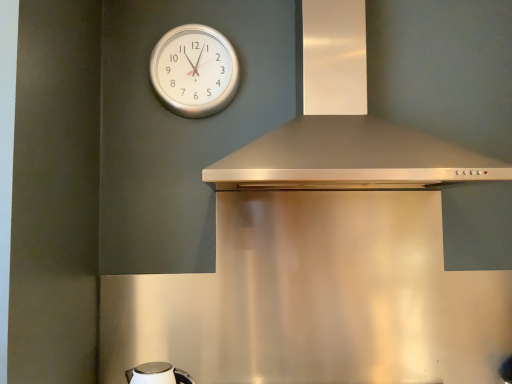
What is the approximate width of satin silver vent at upper center?

It is 48.43 centimeters.

This screenshot has width=512, height=384. What do you see at coordinates (194, 71) in the screenshot?
I see `silver metallic clock at upper center` at bounding box center [194, 71].

Measure the distance between point (170, 374) and camera.

Point (170, 374) is 5.15 feet from camera.

Where is `satin silver vent at upper center`? satin silver vent at upper center is located at coordinates (345, 126).

Is point (211, 87) closer or farther from the camera than point (149, 377)?

Clearly, point (211, 87) is more distant from the camera than point (149, 377).

Could you tell me if silver metallic clock at upper center is facing white glossy kettle at lower left?

No, silver metallic clock at upper center is not facing towards white glossy kettle at lower left.

From a real-world perspective, who is located higher, silver metallic clock at upper center or white glossy kettle at lower left?

From a 3D spatial view, silver metallic clock at upper center is above.

Where is `wall clock behind the satin silver vent at upper center`? The image size is (512, 384). wall clock behind the satin silver vent at upper center is located at coordinates (194, 71).

Could you tell me if satin silver vent at upper center is turned towards silver metallic clock at upper center?

No.

What's the angular difference between satin silver vent at upper center and silver metallic clock at upper center's facing directions?

The angular difference between satin silver vent at upper center and silver metallic clock at upper center is 0.00023 degrees.

Looking at this image, from the image's perspective, is satin silver vent at upper center over silver metallic clock at upper center?

No, from the image's perspective, satin silver vent at upper center is not over silver metallic clock at upper center.

Can you tell me how much satin silver vent at upper center and white glossy kettle at lower left differ in facing direction?

satin silver vent at upper center and white glossy kettle at lower left are facing 1.56 degrees away from each other.

Is satin silver vent at upper center placed right next to white glossy kettle at lower left?

No, satin silver vent at upper center is not in contact with white glossy kettle at lower left.

In the image, is satin silver vent at upper center on the left side or the right side of white glossy kettle at lower left?

In the image, satin silver vent at upper center appears on the right side of white glossy kettle at lower left.

Locate an element on the screen. vent located above the white glossy kettle at lower left (from the image's perspective) is located at coordinates (345, 126).

Which object is further away from the camera taking this photo, white glossy kettle at lower left or silver metallic clock at upper center?

silver metallic clock at upper center.

Between point (168, 370) and point (178, 105), which one is positioned in front?

The point (168, 370) is closer to the camera.

Choose the correct answer: Is white glossy kettle at lower left inside silver metallic clock at upper center or outside it?

white glossy kettle at lower left lies outside silver metallic clock at upper center.

Is white glossy kettle at lower left next to silver metallic clock at upper center?

No, white glossy kettle at lower left is not beside silver metallic clock at upper center.

Does point (164, 369) appear closer or farther from the camera than point (321, 179)?

Point (164, 369) is farther from the camera than point (321, 179).

Considering the relative sizes of white glossy kettle at lower left and satin silver vent at upper center in the image provided, is white glossy kettle at lower left shorter than satin silver vent at upper center?

Yes, white glossy kettle at lower left is shorter than satin silver vent at upper center.

From the image's perspective, is white glossy kettle at lower left on top of satin silver vent at upper center?

No, from the image's perspective, white glossy kettle at lower left is not above satin silver vent at upper center.

Would you say silver metallic clock at upper center is to the left or to the right of satin silver vent at upper center in the picture?

In the image, silver metallic clock at upper center appears on the left side of satin silver vent at upper center.

Can you tell me how much silver metallic clock at upper center and satin silver vent at upper center differ in facing direction?

The angle between the facing direction of silver metallic clock at upper center and the facing direction of satin silver vent at upper center is 0.00023 degrees.

From the image's perspective, relative to satin silver vent at upper center, is silver metallic clock at upper center above or below?

From the image's perspective, silver metallic clock at upper center appears above satin silver vent at upper center.

Choose the correct answer: Is silver metallic clock at upper center inside satin silver vent at upper center or outside it?

silver metallic clock at upper center is not enclosed by satin silver vent at upper center.

Find the location of `wall clock above the white glossy kettle at lower left (from the image's perspective)`. wall clock above the white glossy kettle at lower left (from the image's perspective) is located at coordinates click(194, 71).

Locate an element on the screen. vent located below the silver metallic clock at upper center (from the image's perspective) is located at coordinates (345, 126).

Looking at the image, which one is located further to silver metallic clock at upper center, satin silver vent at upper center or white glossy kettle at lower left?

white glossy kettle at lower left.

Looking at the image, which one is located closer to satin silver vent at upper center, silver metallic clock at upper center or white glossy kettle at lower left?

silver metallic clock at upper center is closer to satin silver vent at upper center.

Consider the image. Based on their spatial positions, is silver metallic clock at upper center or satin silver vent at upper center closer to white glossy kettle at lower left?

satin silver vent at upper center lies closer to white glossy kettle at lower left than the other object.

Looking at the image, which one is located closer to silver metallic clock at upper center, white glossy kettle at lower left or satin silver vent at upper center?

The object closer to silver metallic clock at upper center is satin silver vent at upper center.

Based on their spatial positions, is satin silver vent at upper center or silver metallic clock at upper center closer to white glossy kettle at lower left?

The object closer to white glossy kettle at lower left is satin silver vent at upper center.

Considering their positions, is white glossy kettle at lower left positioned further to satin silver vent at upper center than silver metallic clock at upper center?

white glossy kettle at lower left is positioned further to the anchor satin silver vent at upper center.

Where is `vent between silver metallic clock at upper center and white glossy kettle at lower left vertically`? vent between silver metallic clock at upper center and white glossy kettle at lower left vertically is located at coordinates (345, 126).